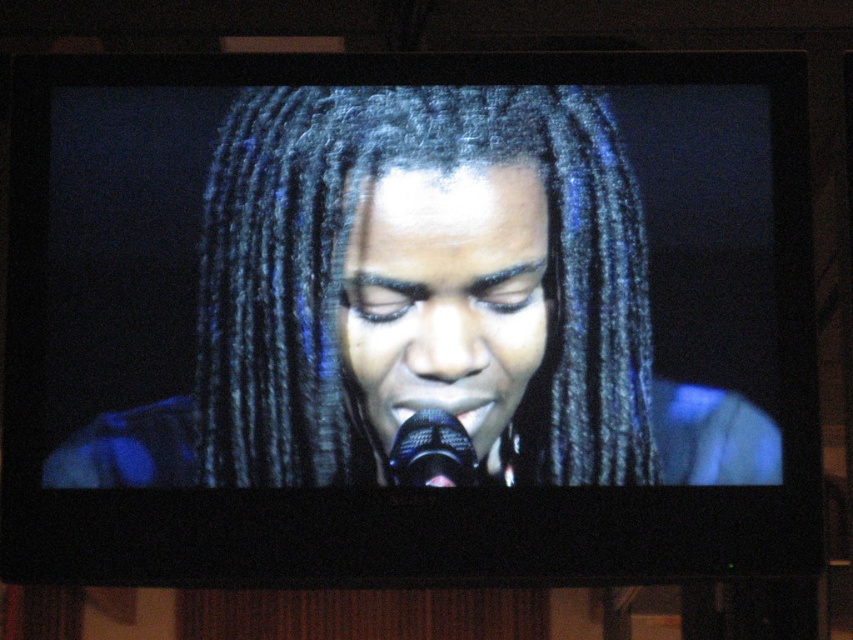
Question: Does black/dark hair at center have a greater width compared to black metallic microphone at center?

Choices:
 (A) no
 (B) yes

Answer: (B)

Question: Among these objects, which one is nearest to the camera?

Choices:
 (A) black metallic microphone at center
 (B) black/dark hair at center

Answer: (A)

Question: Which point appears closest to the camera in this image?

Choices:
 (A) (399, 426)
 (B) (328, 412)

Answer: (A)

Question: Can you confirm if black/dark hair at center is positioned above black metallic microphone at center?

Choices:
 (A) yes
 (B) no

Answer: (A)

Question: Considering the relative positions of black/dark hair at center and black metallic microphone at center in the image provided, where is black/dark hair at center located with respect to black metallic microphone at center?

Choices:
 (A) below
 (B) above

Answer: (B)